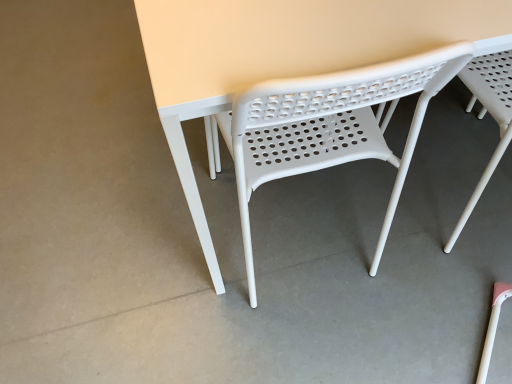
Where is `vacant space to the right of white plastic chair at center`? The width and height of the screenshot is (512, 384). vacant space to the right of white plastic chair at center is located at coordinates (416, 253).